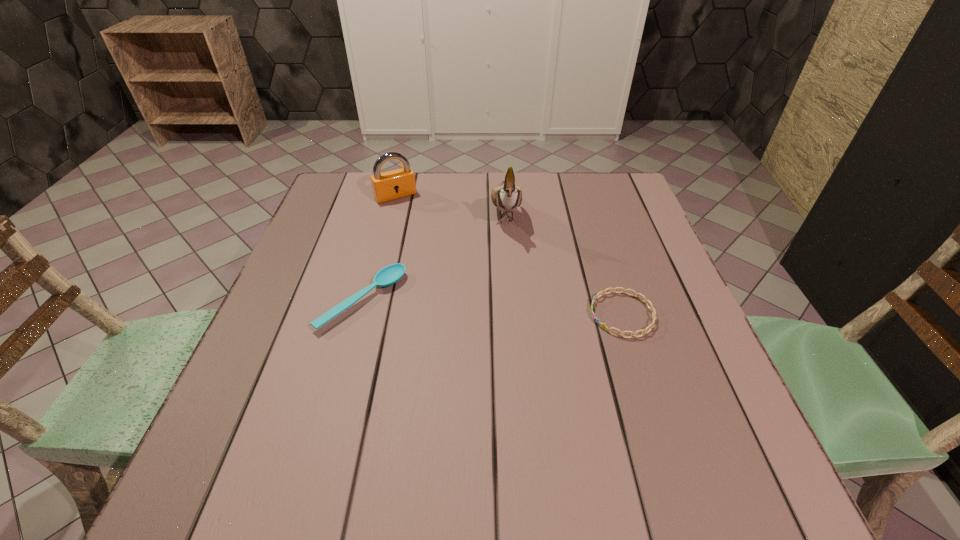
This screenshot has width=960, height=540. In order to click on free space between the second object from right to left and the padlock in this screenshot , I will do `click(450, 204)`.

Where is `vacant area that lies between the second tallest object and the spoon`? This screenshot has height=540, width=960. vacant area that lies between the second tallest object and the spoon is located at coordinates (379, 248).

Locate an element on the screen. This screenshot has height=540, width=960. free area in between the second object from right to left and the third shortest object is located at coordinates (450, 204).

This screenshot has width=960, height=540. I want to click on unoccupied area between the third object from left to right and the third shortest object, so click(x=450, y=204).

I want to click on vacant area between the bracelet and the padlock, so click(x=509, y=255).

You are a GUI agent. You are given a task and a screenshot of the screen. Output one action in this format:
    pyautogui.click(x=<x>, y=<y>)
    Task: Click on the free space between the spoon and the bird
    Image resolution: width=960 pixels, height=540 pixels.
    Given the screenshot: What is the action you would take?
    pyautogui.click(x=434, y=255)

The image size is (960, 540). Find the location of `vacant area that lies between the rightmost object and the tallest object`. vacant area that lies between the rightmost object and the tallest object is located at coordinates (564, 263).

Find the location of `the third closest object to the second tallest object`. the third closest object to the second tallest object is located at coordinates (645, 300).

Identify which object is located as the nearest to the rightmost object. Please provide its 2D coordinates. Your answer should be formatted as a tuple, i.e. [(x, y)], where the tuple contains the x and y coordinates of a point satisfying the conditions above.

[(507, 197)]

Locate an element on the screen. This screenshot has height=540, width=960. free location that satisfies the following two spatial constraints: 1. on the front side of the rightmost object; 2. on the surface of the padlock showing star-shaped elements is located at coordinates (365, 314).